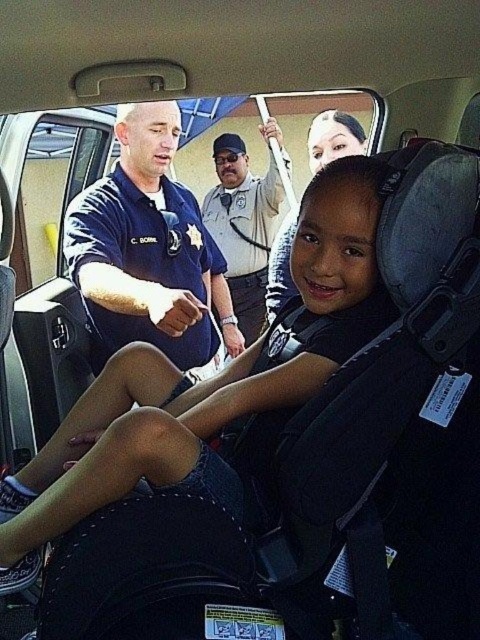
Question: Which object is closer to the camera taking this photo?

Choices:
 (A) blue uniform shirt at upper left
 (B) light brown uniform at center

Answer: (A)

Question: Which point appears closest to the camera in this image?

Choices:
 (A) (179, 262)
 (B) (232, 259)

Answer: (A)

Question: Does blue uniform shirt at upper left appear under light brown uniform at center?

Choices:
 (A) yes
 (B) no

Answer: (A)

Question: Can you confirm if blue uniform shirt at upper left is bigger than light brown uniform at center?

Choices:
 (A) yes
 (B) no

Answer: (A)

Question: Which object appears closest to the camera in this image?

Choices:
 (A) light brown uniform at center
 (B) blue uniform shirt at upper left

Answer: (B)

Question: Does blue uniform shirt at upper left appear under light brown uniform at center?

Choices:
 (A) yes
 (B) no

Answer: (A)